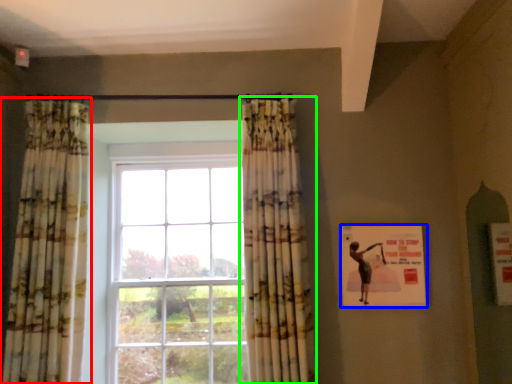
Question: Which object is the farthest from curtain (highlighted by a red box)? Choose among these: poster (highlighted by a blue box) or curtain (highlighted by a green box).

Choices:
 (A) poster
 (B) curtain

Answer: (A)